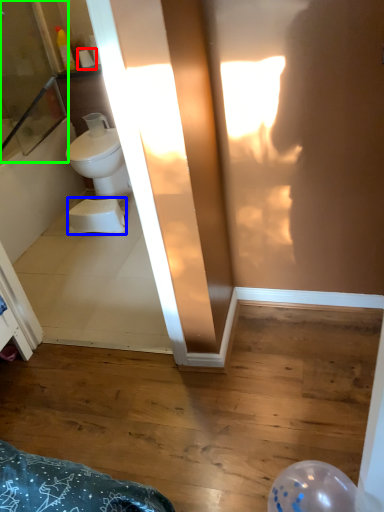
Question: Based on their relative distances, which object is farther from toilet paper (highlighted by a red box)? Choose from toilet bowl (highlighted by a blue box) and screen door (highlighted by a green box).

Choices:
 (A) toilet bowl
 (B) screen door

Answer: (A)